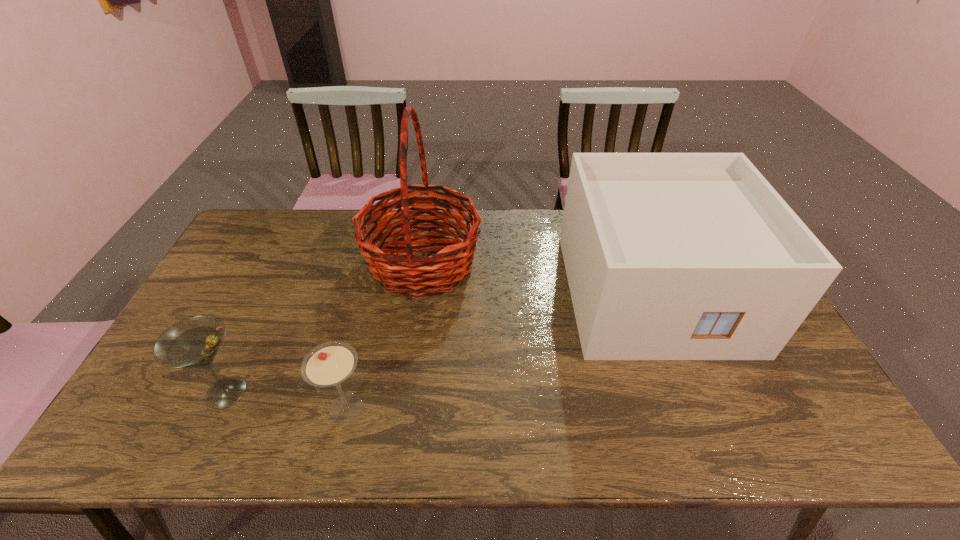
Find the location of `basket`. basket is located at coordinates (406, 273).

Identify the location of the third shortest object. (669, 256).

What are the coordinates of `box` in the screenshot? It's located at (669, 256).

Find the location of a particular element. the third tallest object is located at coordinates (193, 342).

The width and height of the screenshot is (960, 540). Find the location of `the leftmost object`. the leftmost object is located at coordinates (193, 342).

The image size is (960, 540). Identify the location of the shorter martini. click(329, 364).

What are the coordinates of `the shortest object` in the screenshot? It's located at (329, 364).

Identify the location of vacant area situated 0.270m on the front of the tallest object. (405, 386).

I want to click on vacant space located 0.070m on the side of the rightmost object with the window, so click(x=688, y=383).

Image resolution: width=960 pixels, height=540 pixels. I want to click on free spot located 0.070m on the left of the left martini, so click(170, 392).